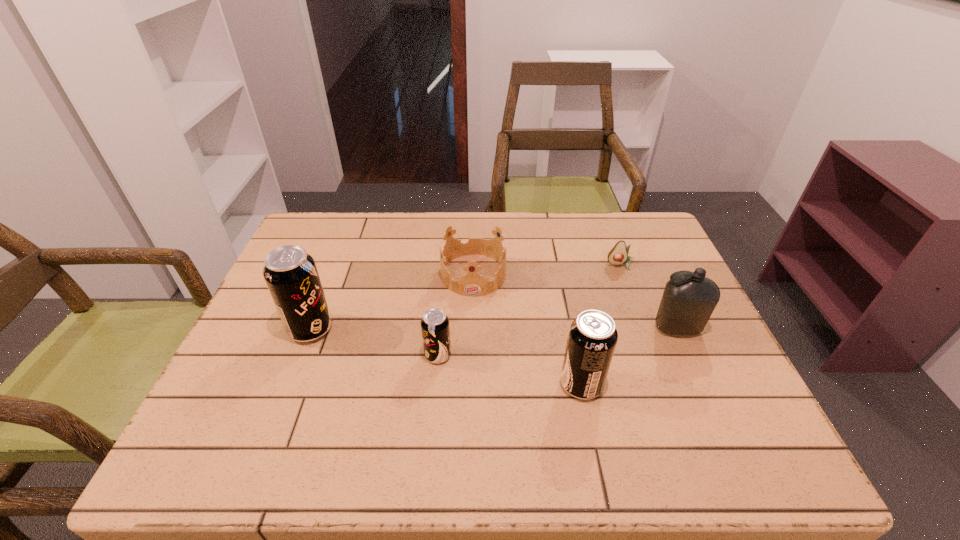
Find the location of a particular element. The width and height of the screenshot is (960, 540). empty space between the rightmost soda can and the second soda can from right to left is located at coordinates (510, 370).

At what (x,y) coordinates should I click in order to perform the action: click on free space that is in between the bottle and the tiara. Please return your answer as a coordinate pair (x, y). This screenshot has width=960, height=540. Looking at the image, I should click on (575, 301).

Locate an element on the screen. The height and width of the screenshot is (540, 960). free spot between the nearest object and the tiara is located at coordinates (527, 329).

The width and height of the screenshot is (960, 540). Find the location of `object that is the fourth closest one to the second soda can from right to left`. object that is the fourth closest one to the second soda can from right to left is located at coordinates (687, 303).

Where is `object that stands as the third closest to the shortest soda can`? object that stands as the third closest to the shortest soda can is located at coordinates (592, 338).

The image size is (960, 540). What are the coordinates of `soda can that stands as the closest to the tiara` in the screenshot? It's located at (435, 328).

Select which soda can is the closest to the bottle. Please provide its 2D coordinates. Your answer should be formatted as a tuple, i.e. [(x, y)], where the tuple contains the x and y coordinates of a point satisfying the conditions above.

[(592, 338)]

At what (x,y) coordinates should I click in order to perform the action: click on vacant point that satisfies the following two spatial constraints: 1. on the front-facing side of the tiara; 2. on the left side of the nearest soda can. Please return your answer as a coordinate pair (x, y). Image resolution: width=960 pixels, height=540 pixels. Looking at the image, I should click on (471, 384).

Where is `free location that satisfies the following two spatial constraints: 1. on the front-facing side of the nearest soda can; 2. on the left side of the tiara`? The height and width of the screenshot is (540, 960). free location that satisfies the following two spatial constraints: 1. on the front-facing side of the nearest soda can; 2. on the left side of the tiara is located at coordinates (471, 384).

Find the location of a particular element. The image size is (960, 540). vacant space that satisfies the following two spatial constraints: 1. on the back side of the bottle; 2. on the right side of the second shortest soda can is located at coordinates (569, 328).